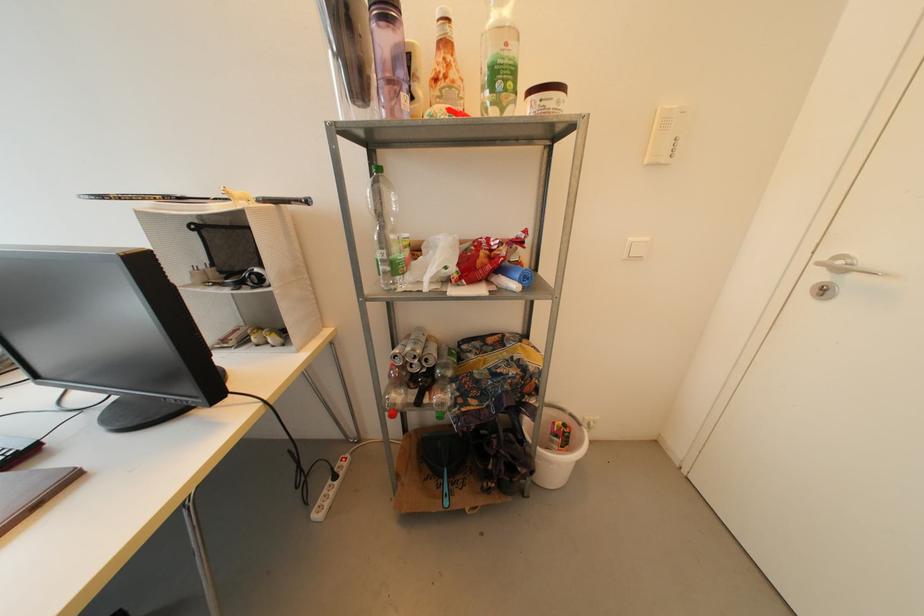
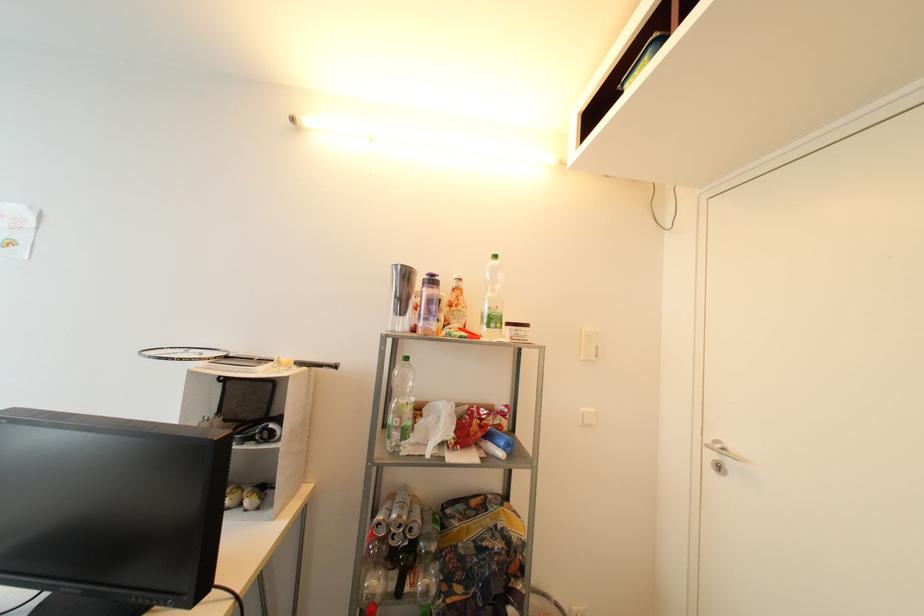
Find the pixel in the second image that matches pixel 829 259 in the first image.

(713, 442)